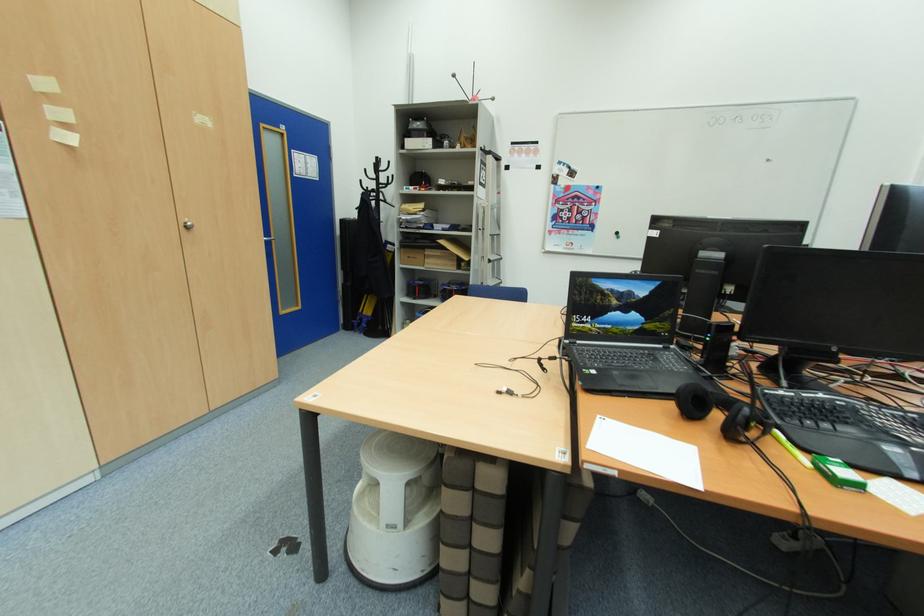
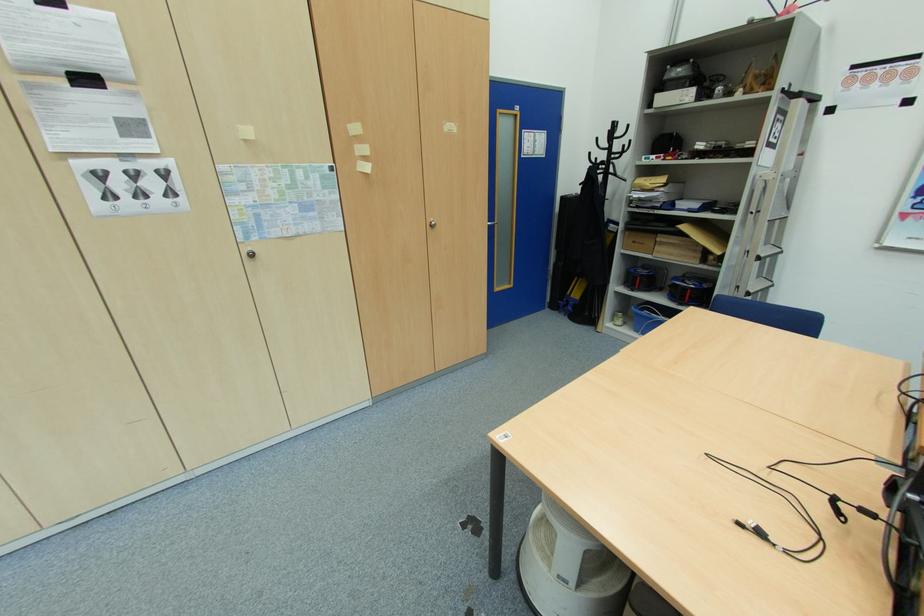
Where in the second image is the point corresponding to pixel 189 224 from the first image?

(434, 224)